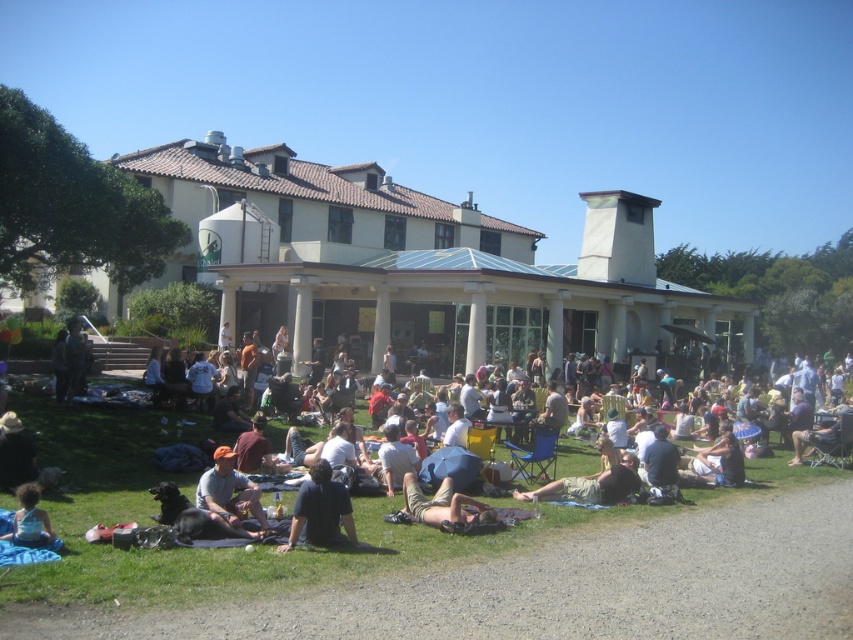
You are standing at the entrance of the building and want to reach a specific point marked at coordinates point (x=228, y=484). If your walking speed is 3 feet per second, how many seconds will it take you to reach that point?

The distance of point (x=228, y=484) from viewer is 33.40 feet. At a speed of 3 feet per second, it will take approximately 11.13 seconds to reach the point.

You are standing at the point marked by the coordinates point (229, 492). Looking towards the large building with a Spanish style architecture, which direction should you walk to reach the entrance of the building?

The gray cotton shirt at lower center is located at point (229, 492). Since the building is in the background, you should walk forward towards the building to reach its entrance.

You are a photographer trying to capture a candid shot of the dark blue shirt at lower center and the tan cotton shorts at lower center. Since you want to focus on the clothing items, which one should you adjust your camera focus to first if you want to ensure both are in the frame?

The dark blue shirt at lower center is above the tan cotton shorts at lower center, so you should focus on the dark blue shirt at lower center first to ensure both are in the frame.